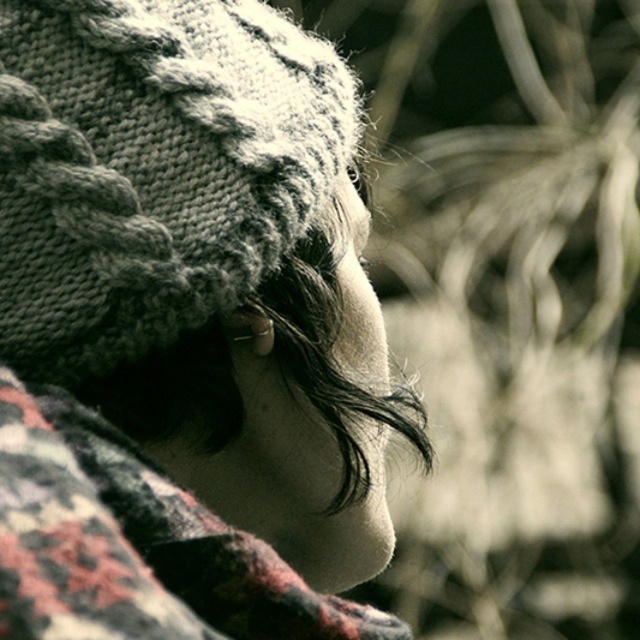
Which is behind, point (321, 605) or point (109, 216)?

The point (109, 216) is more distant.

Locate an element on the screen. This screenshot has height=640, width=640. knitted woolen hat at upper left is located at coordinates (186, 328).

Which is above, knitted gray hat at upper left or plaid wool shawl at center?

Positioned higher is knitted gray hat at upper left.

Is point (189, 96) in front of point (20, 628)?

That is False.

Identify the location of knitted gray hat at upper left. (152, 168).

Is knitted woolen hat at upper left to the right of plaid wool shawl at center from the viewer's perspective?

In fact, knitted woolen hat at upper left is to the left of plaid wool shawl at center.

Which is more to the left, knitted woolen hat at upper left or plaid wool shawl at center?

From the viewer's perspective, knitted woolen hat at upper left appears more on the left side.

Between point (186, 102) and point (140, 524), which one is positioned in front?

Point (140, 524) is in front.

Locate an element on the screen. This screenshot has width=640, height=640. knitted woolen hat at upper left is located at coordinates (186, 328).